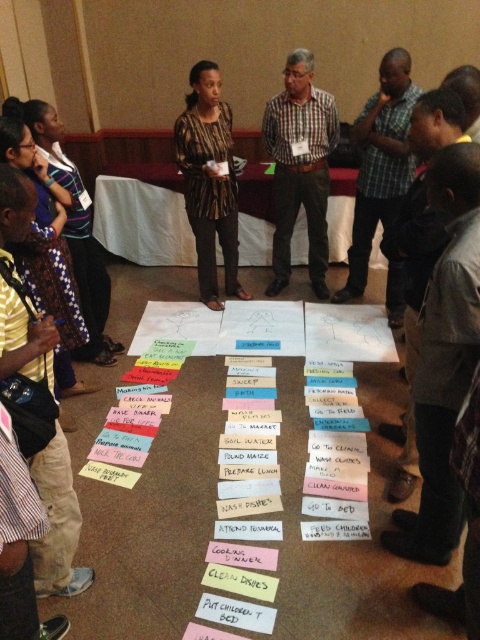
Question: Is yellow striped shirt at left to the left of checkered fabric shirt at center from the viewer's perspective?

Choices:
 (A) yes
 (B) no

Answer: (A)

Question: Which object is the closest to the patterned fabric shirt at center?

Choices:
 (A) checkered fabric shirt at center
 (B) yellow striped shirt at left
 (C) plaid shirt at center

Answer: (A)

Question: Which of the following is the farthest from the observer?

Choices:
 (A) checkered fabric shirt at center
 (B) plaid shirt at center
 (C) yellow striped shirt at left
 (D) patterned fabric shirt at center

Answer: (A)

Question: Is checkered fabric shirt at center to the left of patterned fabric shirt at center from the viewer's perspective?

Choices:
 (A) no
 (B) yes

Answer: (A)

Question: Where is yellow striped shirt at left located in relation to checkered fabric shirt at center in the image?

Choices:
 (A) above
 (B) below

Answer: (B)

Question: Which object appears farthest from the camera in this image?

Choices:
 (A) yellow striped shirt at left
 (B) plaid shirt at center
 (C) patterned fabric shirt at center
 (D) checkered fabric shirt at center

Answer: (D)